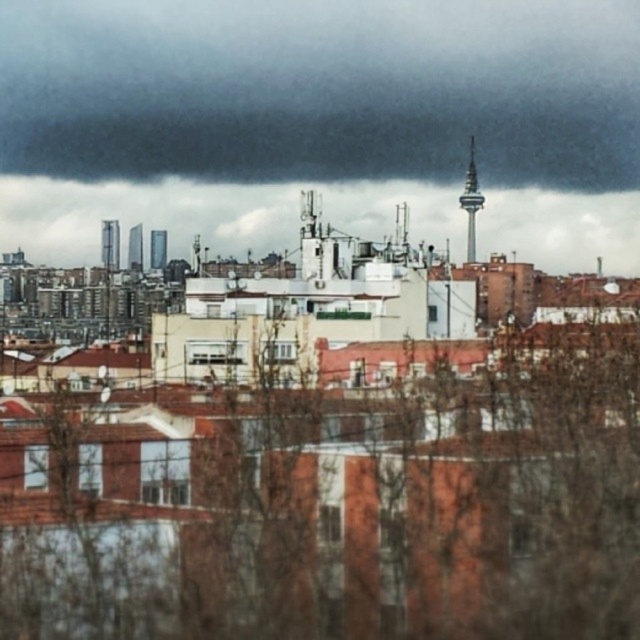
Consider the image. You are an airplane pilot preparing to land in the city. You notice the dark gray cloud at upper center and the cloudy sky at upper center. Which one is closer to your plane?

The dark gray cloud at upper center is closer to your plane because it is further to the viewer than the cloudy sky at upper center.

Based on the photo, you are an architect designing a new building in the city. You notice the dark gray cloud at upper center and the cloudy sky at upper center. Which of these two objects is located to the left?

The dark gray cloud at upper center is positioned on the left side of cloudy sky at upper center.